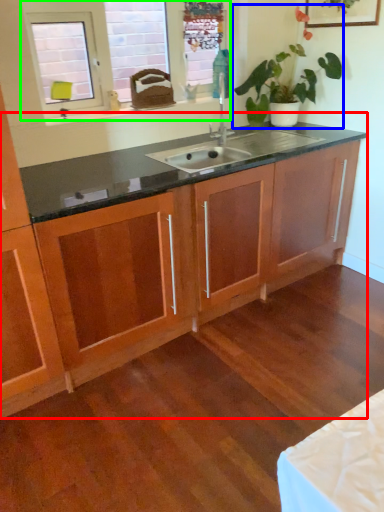
Question: Based on their relative distances, which object is nearer to dresser (highlighted by a red box)? Choose from houseplant (highlighted by a blue box) and window (highlighted by a green box).

Choices:
 (A) houseplant
 (B) window

Answer: (A)